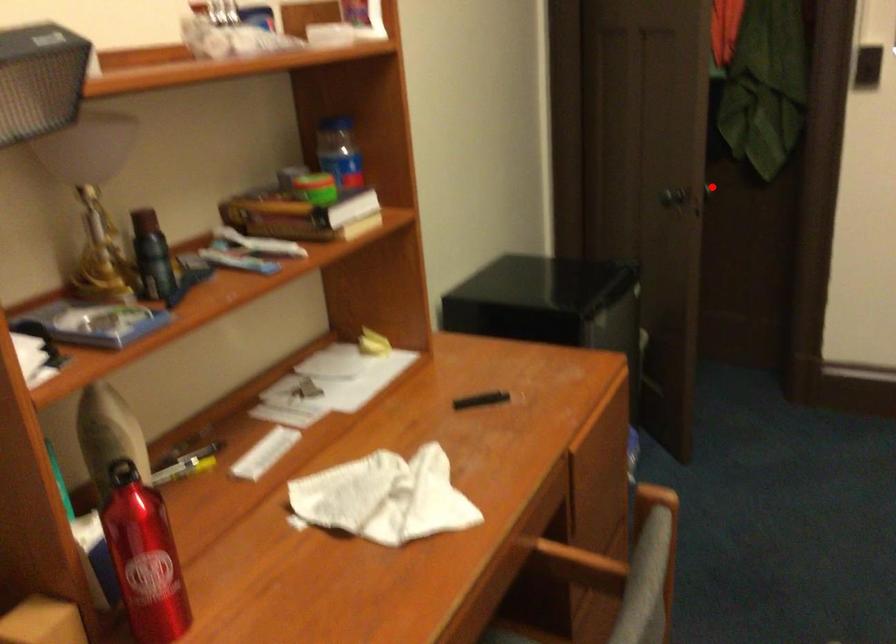
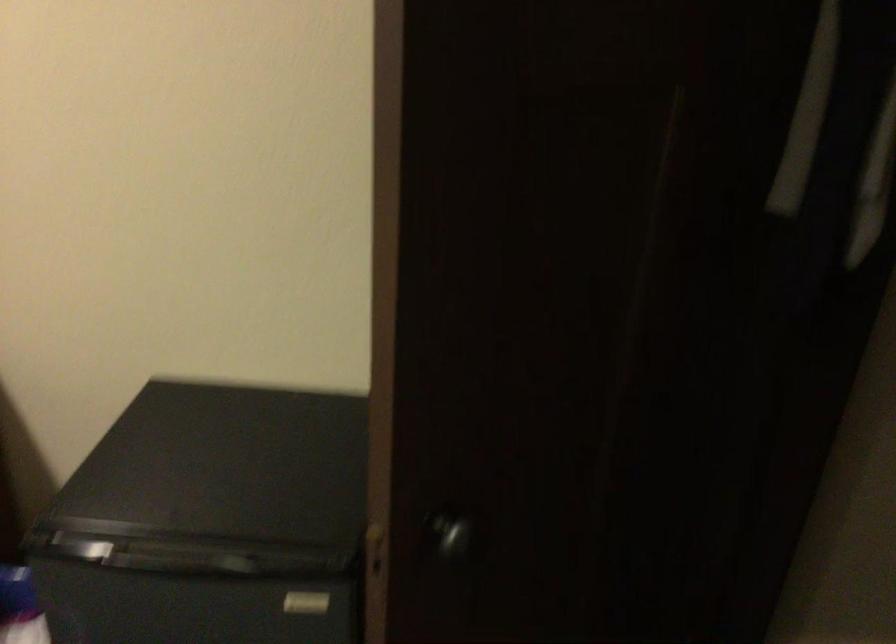
Question: I am providing you with two images of the same scene from different viewpoints. A red point is marked on the first image. At the location where the point appears in image 1, is it still visible in image 2?

Choices:
 (A) Yes
 (B) No

Answer: (A)